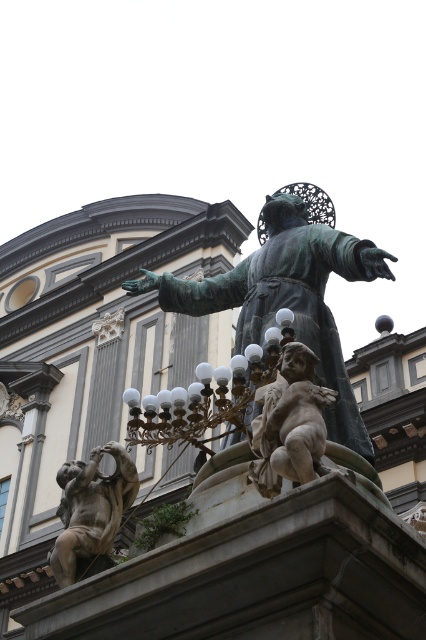
Looking at this image, you are an art student analyzing the composition of the image. You notice the green patina statue at center and the bronze cherub at lower left. Based on their positions, which object is positioned to the right side of the other?

The green patina statue at center is to the right of bronze cherub at lower left according to the description.

Based on the photo, you are an interior designer assessing the space between the bronze lamp at center and the bronze cherub at lower left for placing a new decorative item. Based on their widths, which object requires more horizontal space?

The bronze lamp at center requires more horizontal space because its width surpasses that of the bronze cherub at lower left.